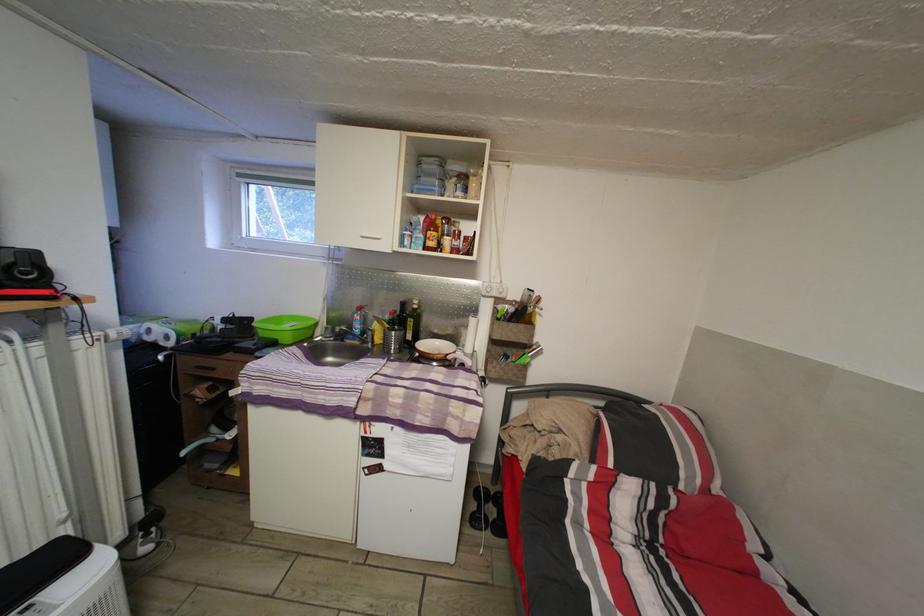
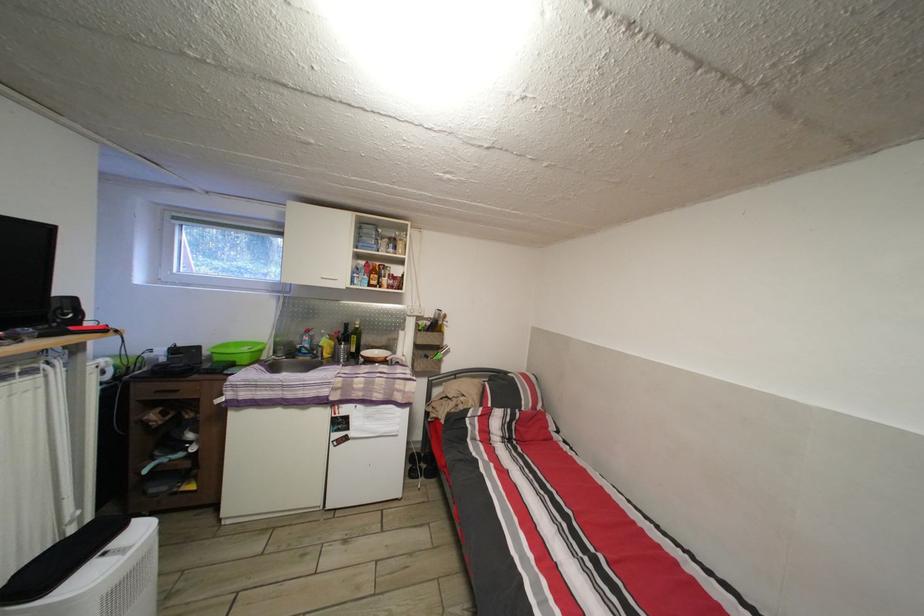
The point at (418, 329) is marked in the first image. Where is the corresponding point in the second image?

(360, 345)